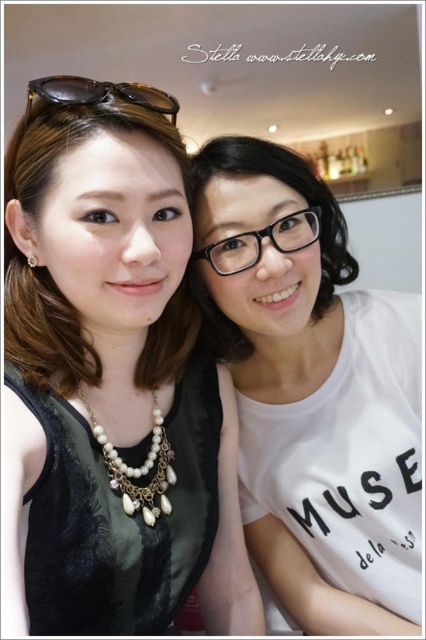
Question: Which point is farther to the camera?

Choices:
 (A) (120, 488)
 (B) (80, 456)
 (C) (339, 595)

Answer: (C)

Question: Can you confirm if white matte t-shirt at center is positioned to the left of pearl/golden chain necklace at center?

Choices:
 (A) no
 (B) yes

Answer: (A)

Question: Can you confirm if white matte t-shirt at center is positioned to the right of pearl/golden chain necklace at center?

Choices:
 (A) no
 (B) yes

Answer: (B)

Question: Does matte black dress at left have a lesser width compared to white matte t-shirt at center?

Choices:
 (A) no
 (B) yes

Answer: (A)

Question: Which object appears closest to the camera in this image?

Choices:
 (A) matte black dress at left
 (B) white matte t-shirt at center
 (C) pearl/golden chain necklace at center

Answer: (A)

Question: Which is nearer to the matte black dress at left?

Choices:
 (A) white matte t-shirt at center
 (B) pearl/golden chain necklace at center

Answer: (B)